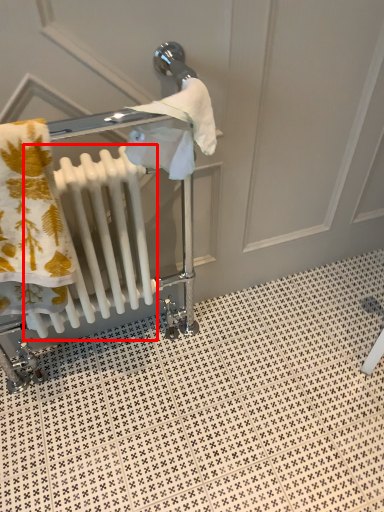
Question: Observing the image, what is the correct spatial positioning of radiator (annotated by the red box) in reference to tile?

Choices:
 (A) right
 (B) left

Answer: (B)